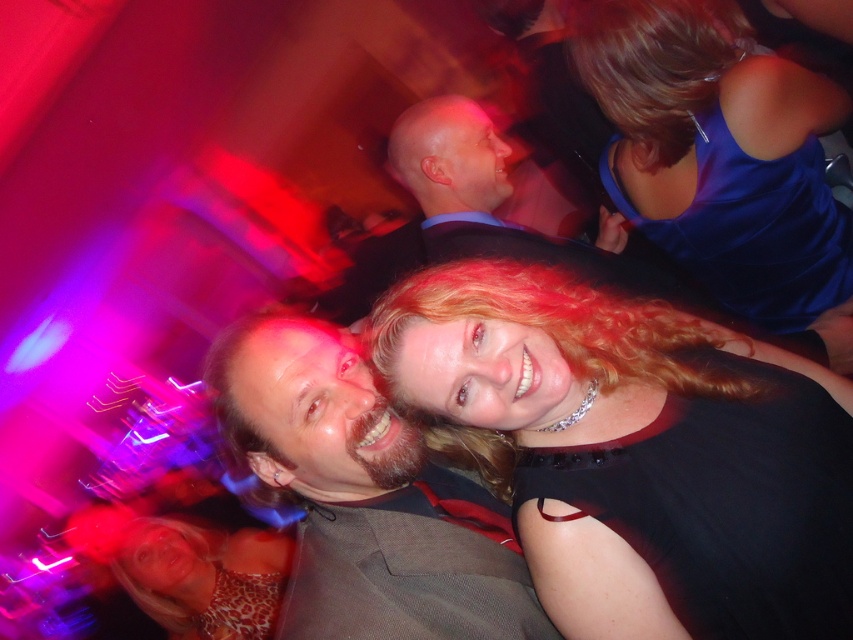
Question: Which of the following is the farthest from the observer?

Choices:
 (A) leopard print dress at lower left
 (B) shiny blue dress at upper right
 (C) dark brown leather jacket at center
 (D) shiny black dress at center

Answer: (A)

Question: Is shiny black dress at center behind dark brown leather jacket at center?

Choices:
 (A) no
 (B) yes

Answer: (A)

Question: Which point is farther to the camera?

Choices:
 (A) (325, 406)
 (B) (492, 298)

Answer: (A)

Question: Which of the following is the farthest from the observer?

Choices:
 (A) shiny black dress at center
 (B) shiny blue dress at upper right

Answer: (B)

Question: Does shiny black suit at center have a greater width compared to leopard print dress at lower left?

Choices:
 (A) yes
 (B) no

Answer: (A)

Question: Can you confirm if dark brown leather jacket at center is bigger than shiny black suit at center?

Choices:
 (A) no
 (B) yes

Answer: (A)